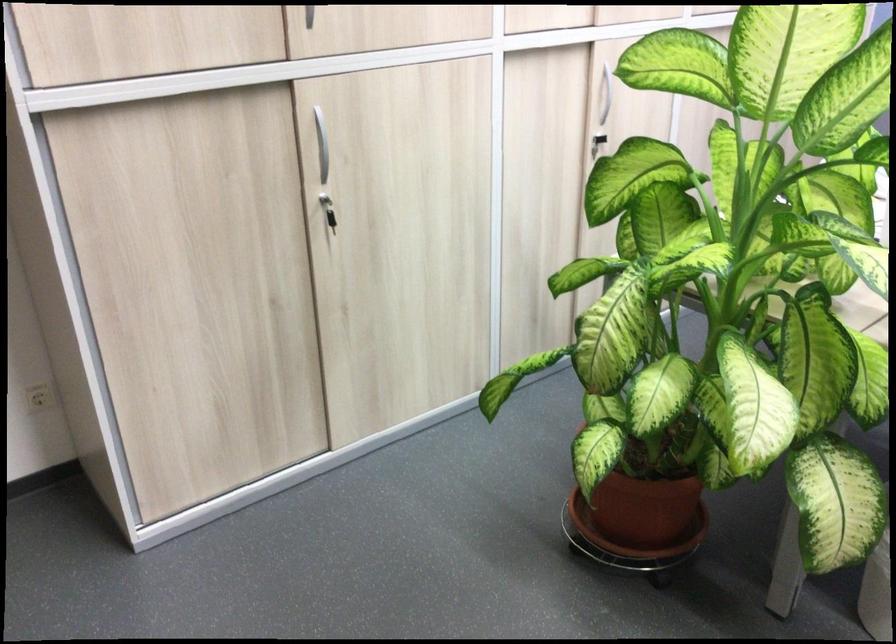
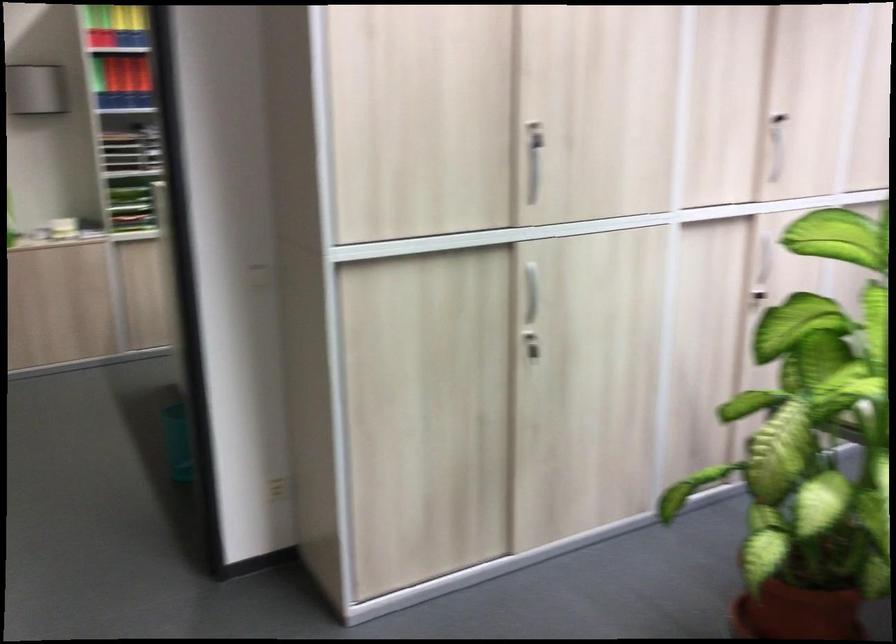
Locate, in the second image, the point that corresponds to (607,93) in the first image.

(764, 257)